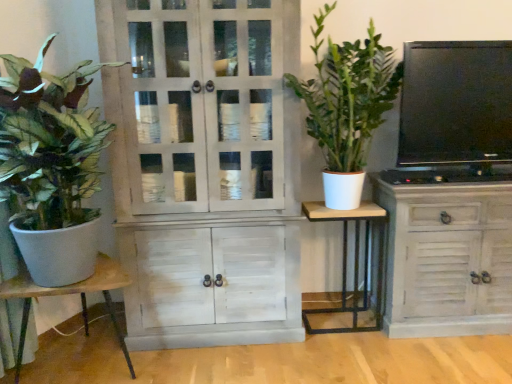
Find the location of a particular element. Image resolution: width=512 pixels, height=384 pixels. vacant area that is in front of white wood cabinet at center, which is counted as the 2th cabinetry, starting from the right is located at coordinates (223, 364).